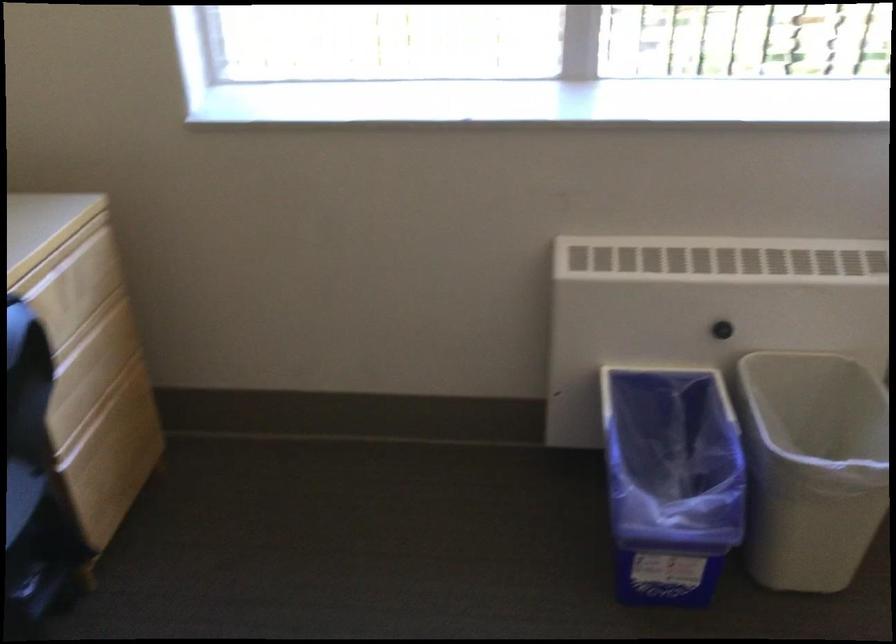
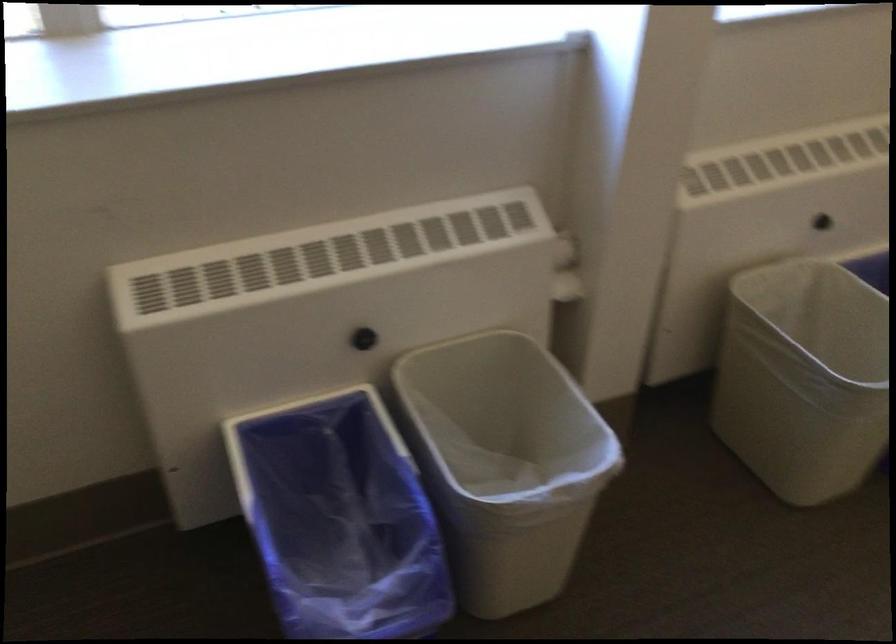
In the second image, find the point that corresponds to point 824,438 in the first image.

(506, 424)